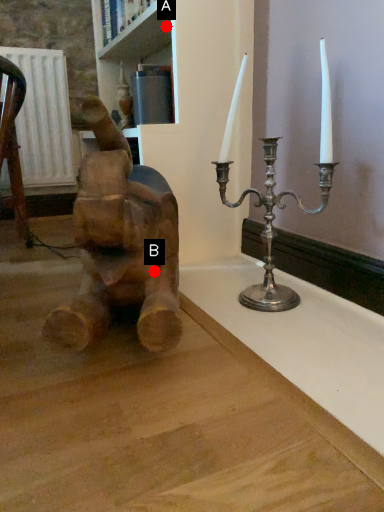
Question: Two points are circled on the image, labeled by A and B beside each circle. Among these points, which one is nearest to the camera?

Choices:
 (A) A is closer
 (B) B is closer

Answer: (B)